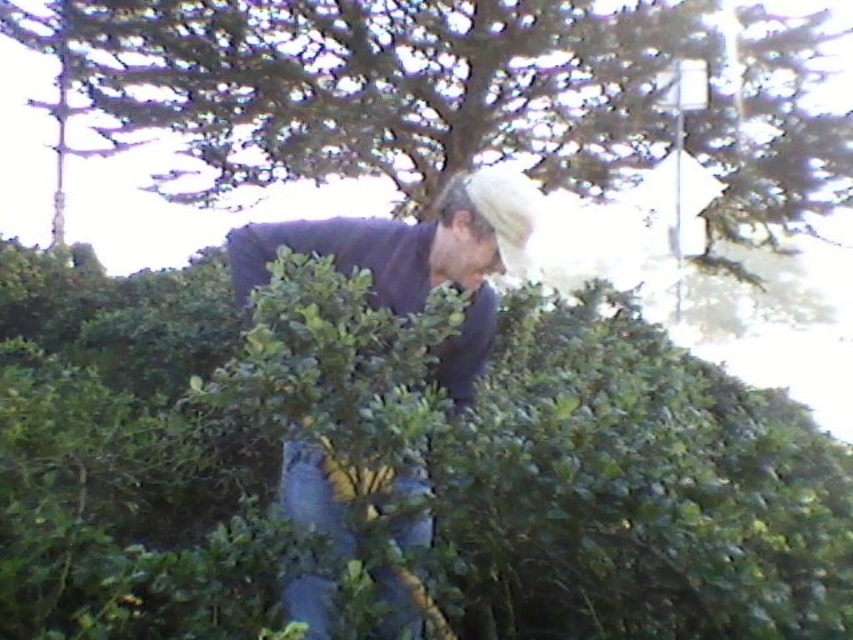
Does green leafy hedge at center have a lesser width compared to dark blue sweater at center?

No, green leafy hedge at center is not thinner than dark blue sweater at center.

Where is `green leafy hedge at center`? green leafy hedge at center is located at coordinates (399, 458).

Is dark blue sweater at center above green leafy bush at center?

Actually, dark blue sweater at center is below green leafy bush at center.

Does dark blue sweater at center appear under green leafy bush at center?

Yes, dark blue sweater at center is below green leafy bush at center.

What do you see at coordinates (416, 259) in the screenshot? I see `dark blue sweater at center` at bounding box center [416, 259].

Locate an element on the screen. Image resolution: width=853 pixels, height=640 pixels. dark blue sweater at center is located at coordinates (416, 259).

Which is behind, point (90, 316) or point (846, 52)?

Point (846, 52)

This screenshot has width=853, height=640. What do you see at coordinates (399, 458) in the screenshot?
I see `green leafy hedge at center` at bounding box center [399, 458].

In order to click on green leafy hedge at center in this screenshot , I will do `click(399, 458)`.